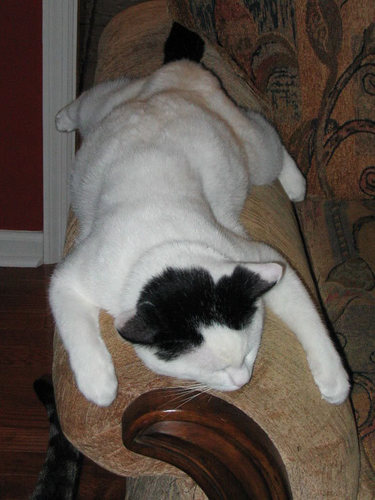
You are a GUI agent. You are given a task and a screenshot of the screen. Output one action in this format:
    pyautogui.click(x=<x>, y=<y>)
    Task: Click on the red wall
    Image resolution: width=375 pixels, height=500 pixels.
    Given the screenshot: What is the action you would take?
    pyautogui.click(x=22, y=206)